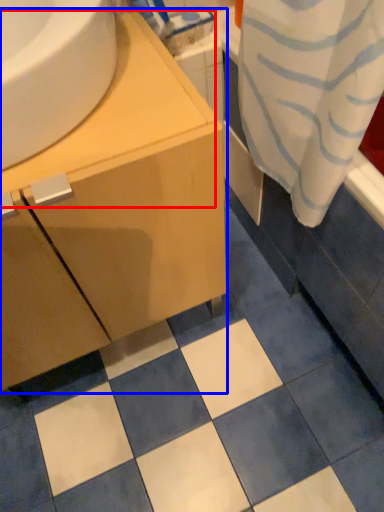
Question: Which object is closer to the camera taking this photo, counter top (highlighted by a red box) or bathroom cabinet (highlighted by a blue box)?

Choices:
 (A) counter top
 (B) bathroom cabinet

Answer: (A)